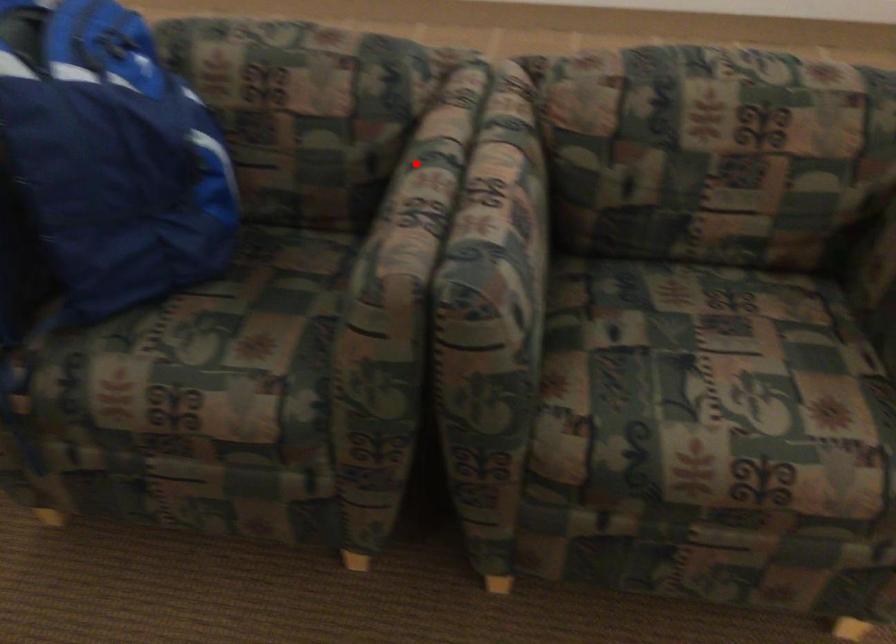
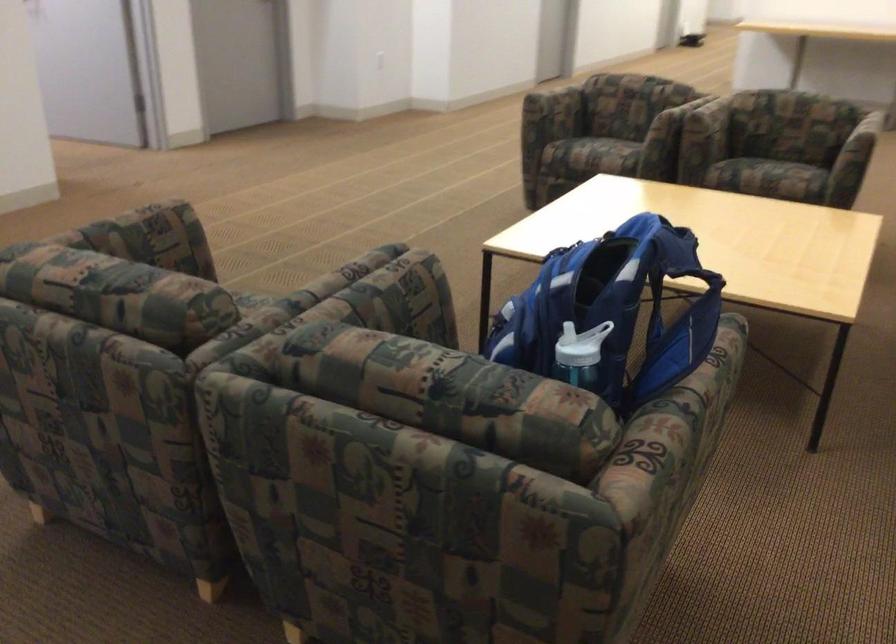
Locate, in the second image, the point that corresponds to the highlighted location in the first image.

(362, 292)